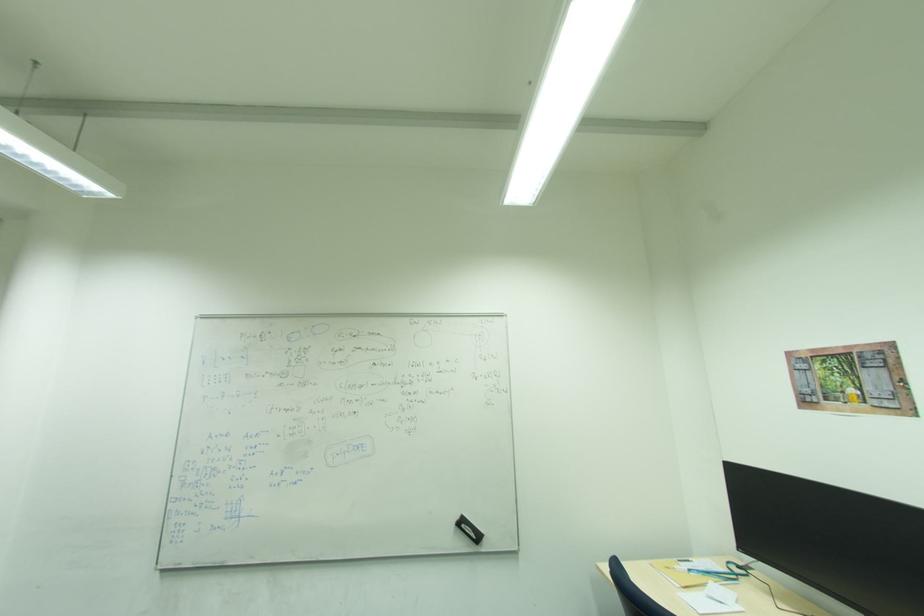
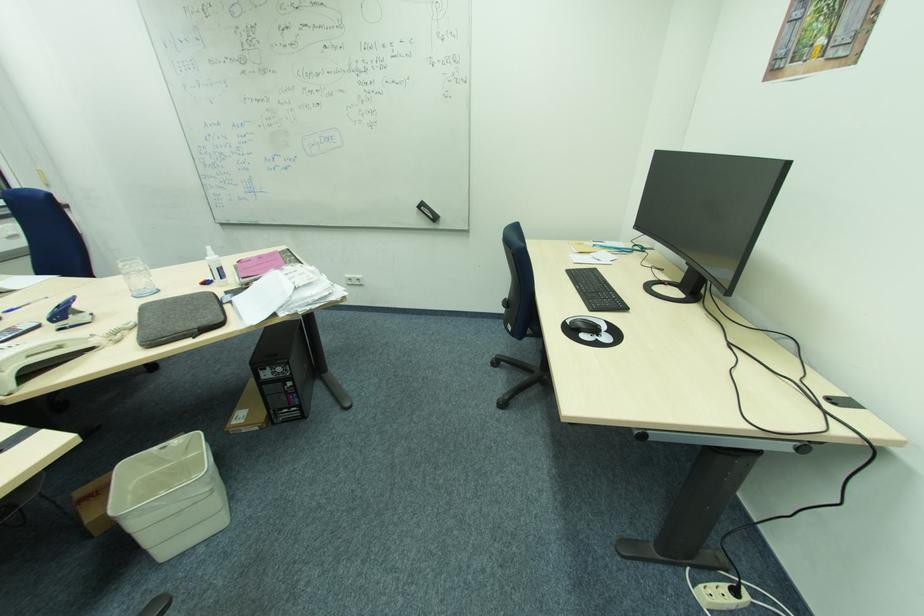
Find the pixel in the second image that matches point 466,525 in the first image.

(426, 208)